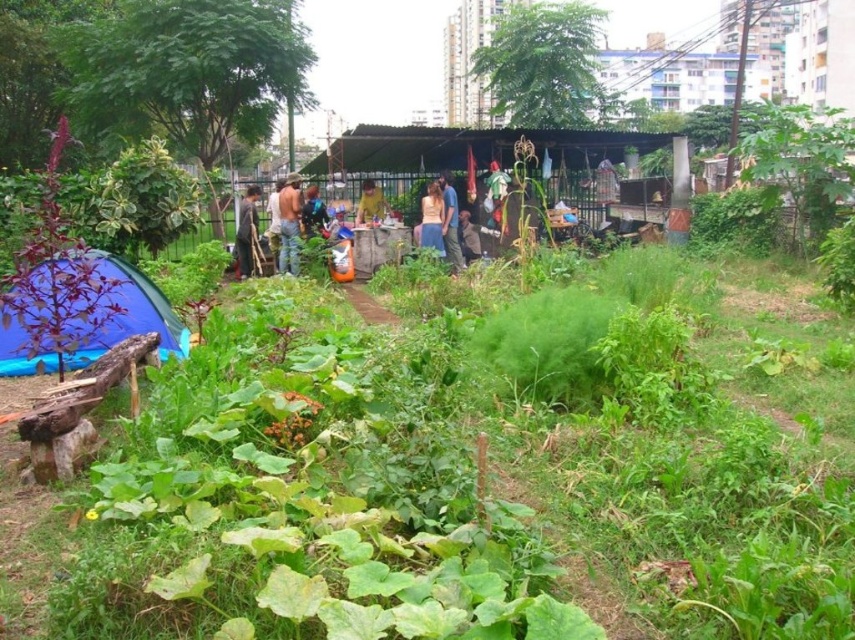
Does yellow shirt at center come in front of brown fabric bag at center?

No, yellow shirt at center is further to the viewer.

Does yellow shirt at center appear on the left side of brown fabric bag at center?

Indeed, yellow shirt at center is positioned on the left side of brown fabric bag at center.

Does point (385, 204) come closer to viewer compared to point (472, 248)?

No, it is behind (472, 248).

The height and width of the screenshot is (640, 855). Find the location of `yellow shirt at center`. yellow shirt at center is located at coordinates (370, 204).

Does denim jacket at center appear on the right side of brown fabric bag at center?

No, denim jacket at center is not to the right of brown fabric bag at center.

Is denim jacket at center in front of brown fabric bag at center?

Yes, it is in front of brown fabric bag at center.

Does point (323, 211) lie in front of point (472, 250)?

Yes, it is.

At what (x,y) coordinates should I click in order to perform the action: click on denim jacket at center. Please return your answer as a coordinate pair (x, y). This screenshot has height=640, width=855. Looking at the image, I should click on (313, 212).

Between point (293, 192) and point (242, 198), which one is positioned in front?

Point (293, 192)

Is brown denim pants at center taller than brown leather jacket at center?

Correct, brown denim pants at center is much taller as brown leather jacket at center.

Is point (280, 209) positioned after point (243, 237)?

No, it is in front of (243, 237).

Image resolution: width=855 pixels, height=640 pixels. In order to click on brown denim pants at center in this screenshot , I will do coord(289,224).